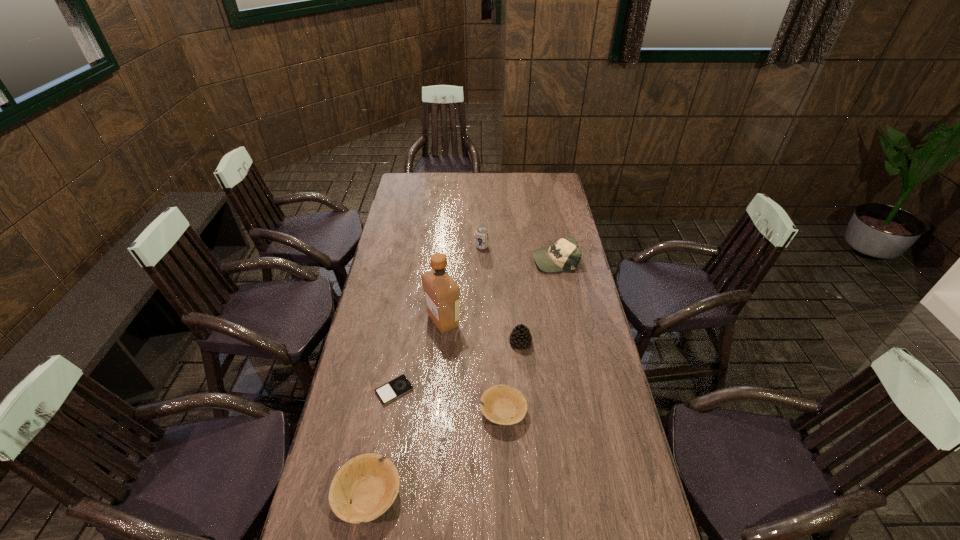
The width and height of the screenshot is (960, 540). Identify the location of blank space that satisfies the following two spatial constraints: 1. on the back side of the shorter bowl; 2. on the left side of the left bowl. (383, 411).

I want to click on vacant space that satisfies the following two spatial constraints: 1. on the front-facing side of the rightmost object; 2. at the narrow end of the pinecone, so click(571, 343).

Image resolution: width=960 pixels, height=540 pixels. Find the location of `vacant region that satisfies the following two spatial constraints: 1. on the front-facing side of the rightmost object; 2. at the narrow end of the pinecone`. vacant region that satisfies the following two spatial constraints: 1. on the front-facing side of the rightmost object; 2. at the narrow end of the pinecone is located at coordinates (571, 343).

In order to click on free space that satisfies the following two spatial constraints: 1. on the front-facing side of the fifth object from right to left; 2. on the front side of the iPod in this screenshot , I will do `click(438, 390)`.

Where is `vacant space that satisfies the following two spatial constraints: 1. on the front-facing side of the shorter bowl; 2. on the left side of the tallest object`? The width and height of the screenshot is (960, 540). vacant space that satisfies the following two spatial constraints: 1. on the front-facing side of the shorter bowl; 2. on the left side of the tallest object is located at coordinates (436, 411).

The width and height of the screenshot is (960, 540). What are the coordinates of `free space that satisfies the following two spatial constraints: 1. on the front-facing side of the baseball cap; 2. at the narrow end of the pinecone` in the screenshot? It's located at [571, 343].